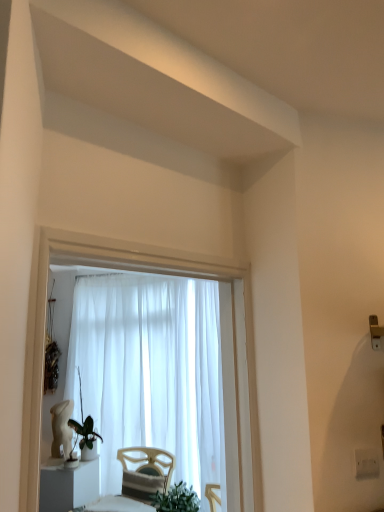
Question: From a real-world perspective, is green matte plant at lower left below white glossy statue at lower left?

Choices:
 (A) no
 (B) yes

Answer: (A)

Question: Can you confirm if green matte plant at lower left is bigger than white glossy statue at lower left?

Choices:
 (A) no
 (B) yes

Answer: (A)

Question: Is green matte plant at lower left behind white glossy statue at lower left?

Choices:
 (A) no
 (B) yes

Answer: (B)

Question: Is green matte plant at lower left looking in the opposite direction of white glossy statue at lower left?

Choices:
 (A) no
 (B) yes

Answer: (A)

Question: From the image's perspective, is green matte plant at lower left located above white glossy statue at lower left?

Choices:
 (A) yes
 (B) no

Answer: (A)

Question: Visually, is white sheer curtain at center positioned to the left or to the right of white plastic electric outlet at lower right?

Choices:
 (A) right
 (B) left

Answer: (B)

Question: Is white sheer curtain at center spatially inside white plastic electric outlet at lower right, or outside of it?

Choices:
 (A) inside
 (B) outside

Answer: (B)

Question: From a real-world perspective, relative to white plastic electric outlet at lower right, is white sheer curtain at center vertically above or below?

Choices:
 (A) above
 (B) below

Answer: (A)

Question: In terms of width, does white sheer curtain at center look wider or thinner when compared to white plastic electric outlet at lower right?

Choices:
 (A) wide
 (B) thin

Answer: (A)

Question: In the image, is green matte plant at lower left positioned in front of or behind white sheer curtain at center?

Choices:
 (A) front
 (B) behind

Answer: (A)

Question: Looking at the image, does green matte plant at lower left seem bigger or smaller compared to white sheer curtain at center?

Choices:
 (A) small
 (B) big

Answer: (A)

Question: Is point pyautogui.click(x=96, y=438) positioned closer to the camera than point pyautogui.click(x=145, y=288)?

Choices:
 (A) closer
 (B) farther

Answer: (A)

Question: In the image, is green matte plant at lower left on the left side or the right side of white sheer curtain at center?

Choices:
 (A) right
 (B) left

Answer: (B)

Question: Does point (97, 406) appear closer or farther from the camera than point (92, 493)?

Choices:
 (A) closer
 (B) farther

Answer: (B)

Question: Visually, is white sheer curtain at center positioned to the left or to the right of white glossy statue at lower left?

Choices:
 (A) right
 (B) left

Answer: (A)